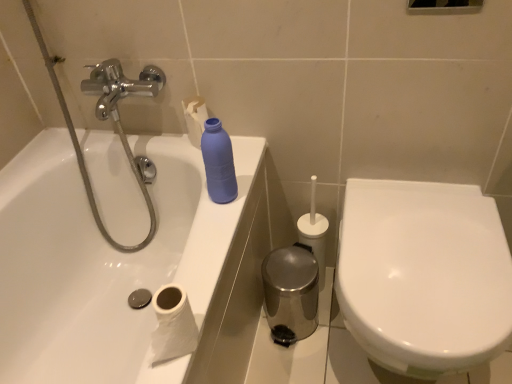
What is the approximate height of matte blue plastic bottle at upper center?

The height of matte blue plastic bottle at upper center is 8.51 inches.

Where is `white glossy toilet at right`? The height and width of the screenshot is (384, 512). white glossy toilet at right is located at coordinates (424, 276).

How far apart are white paper at lower left and matte blue plastic bottle at upper center?

12.79 inches.

Considering the positions of objects white paper at lower left and matte blue plastic bottle at upper center in the image provided, who is more to the right, white paper at lower left or matte blue plastic bottle at upper center?

matte blue plastic bottle at upper center is more to the right.

What's the angular difference between white paper at lower left and matte blue plastic bottle at upper center's facing directions?

0.00104 degrees separate the facing orientations of white paper at lower left and matte blue plastic bottle at upper center.

Between point (175, 341) and point (216, 134), which one is positioned behind?

Point (216, 134)

Is white glossy toilet at right inside or outside of matte blue plastic bottle at upper center?

white glossy toilet at right is not inside matte blue plastic bottle at upper center, it's outside.

Is the depth of white glossy toilet at right greater than that of matte blue plastic bottle at upper center?

No, it is not.

Who is smaller, white glossy toilet at right or matte blue plastic bottle at upper center?

Smaller between the two is matte blue plastic bottle at upper center.

From the image's perspective, does white glossy toilet at right appear higher than matte blue plastic bottle at upper center?

Actually, white glossy toilet at right appears below matte blue plastic bottle at upper center in the image.

Does point (213, 153) lie behind point (157, 306)?

Yes, point (213, 153) is behind point (157, 306).

Does matte blue plastic bottle at upper center have a lesser width compared to white paper at lower left?

Yes, matte blue plastic bottle at upper center is thinner than white paper at lower left.

Is matte blue plastic bottle at upper center spatially inside white paper at lower left, or outside of it?

matte blue plastic bottle at upper center is outside white paper at lower left.

Is white glossy toilet at right inside white paper at lower left?

That's incorrect, white glossy toilet at right is not inside white paper at lower left.

Is white paper at lower left facing away from white glossy toilet at right?

No.

Does white paper at lower left have a larger size compared to white glossy toilet at right?

Incorrect, white paper at lower left is not larger than white glossy toilet at right.

From a real-world perspective, is white paper at lower left below white glossy toilet at right?

Actually, white paper at lower left is physically above white glossy toilet at right in the real world.

Is white glossy toilet at right positioned with its back to white paper at lower left?

white glossy toilet at right is not turned away from white paper at lower left.

Would you say white glossy toilet at right is outside white paper at lower left?

That's correct, white glossy toilet at right is outside of white paper at lower left.

In the scene shown: Can you confirm if white glossy toilet at right is taller than white paper at lower left?

Correct, white glossy toilet at right is much taller as white paper at lower left.

Considering the sizes of objects white glossy toilet at right and white paper at lower left in the image provided, who is wider, white glossy toilet at right or white paper at lower left?

white glossy toilet at right.

Who is smaller, matte blue plastic bottle at upper center or white glossy toilet at right?

Smaller between the two is matte blue plastic bottle at upper center.

Which object is further away from the camera, matte blue plastic bottle at upper center or white glossy toilet at right?

matte blue plastic bottle at upper center is behind.

Would you say matte blue plastic bottle at upper center contains white glossy toilet at right?

No.

This screenshot has height=384, width=512. I want to click on cleaning product above the white paper at lower left (from a real-world perspective), so click(x=218, y=162).

In the image, there is a white glossy toilet at right. At what (x,y) coordinates should I click in order to perform the action: click on cleaning product above it (from the image's perspective). Please return your answer as a coordinate pair (x, y). Looking at the image, I should click on (218, 162).

When comparing their distances from matte blue plastic bottle at upper center, does white glossy toilet at right or white paper at lower left seem further?

white glossy toilet at right.

Based on their spatial positions, is matte blue plastic bottle at upper center or white glossy toilet at right further from white paper at lower left?

The object further to white paper at lower left is white glossy toilet at right.

Which object lies further to the anchor point white glossy toilet at right, matte blue plastic bottle at upper center or white paper at lower left?

white paper at lower left lies further to white glossy toilet at right than the other object.

When comparing their distances from white paper at lower left, does white glossy toilet at right or matte blue plastic bottle at upper center seem closer?

Among the two, matte blue plastic bottle at upper center is located nearer to white paper at lower left.

Considering their positions, is white paper at lower left positioned closer to matte blue plastic bottle at upper center than white glossy toilet at right?

Based on the image, white paper at lower left appears to be nearer to matte blue plastic bottle at upper center.

Looking at this image, when comparing their distances from white glossy toilet at right, does white paper at lower left or matte blue plastic bottle at upper center seem further?

The object further to white glossy toilet at right is white paper at lower left.

The height and width of the screenshot is (384, 512). What are the coordinates of `cleaning product between white paper at lower left and white glossy toilet at right` in the screenshot? It's located at (218, 162).